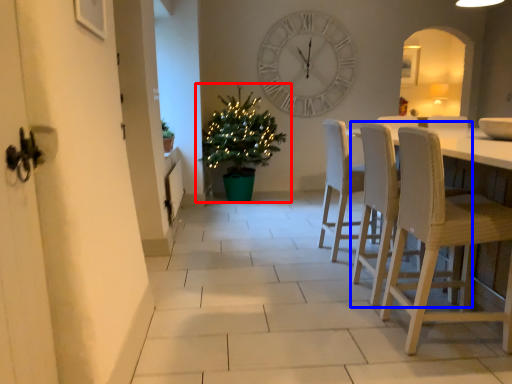
Question: Among these objects, which one is farthest to the camera, houseplant (highlighted by a red box) or chair (highlighted by a blue box)?

Choices:
 (A) houseplant
 (B) chair

Answer: (A)